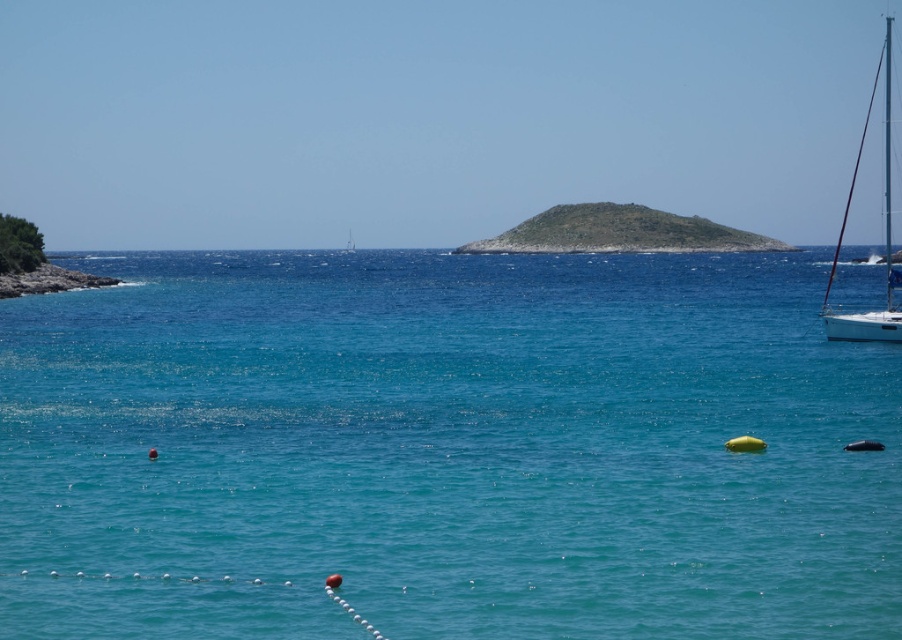
Can you confirm if clear blue water at center is taller than green grassy island at center?

Yes, clear blue water at center is taller than green grassy island at center.

This screenshot has height=640, width=902. I want to click on clear blue water at center, so click(445, 449).

Which is in front, point (380, 618) or point (529, 244)?

Positioned in front is point (380, 618).

In order to click on clear blue water at center in this screenshot , I will do `click(445, 449)`.

What do you see at coordinates (445, 449) in the screenshot?
I see `clear blue water at center` at bounding box center [445, 449].

Which is more to the right, clear blue water at center or smooth stone cliff at lower left?

From the viewer's perspective, clear blue water at center appears more on the right side.

Describe the element at coordinates (445, 449) in the screenshot. The width and height of the screenshot is (902, 640). I see `clear blue water at center` at that location.

Find the location of a particular element. The height and width of the screenshot is (640, 902). clear blue water at center is located at coordinates (445, 449).

Does point (899, 326) come behind point (21, 289)?

No.

In the scene shown: Between white glossy sailboat at right and smooth stone cliff at lower left, which one appears on the right side from the viewer's perspective?

white glossy sailboat at right

You are a GUI agent. You are given a task and a screenshot of the screen. Output one action in this format:
    pyautogui.click(x=<x>, y=<y>)
    Task: Click on the white glossy sailboat at right
    
    Given the screenshot: What is the action you would take?
    pyautogui.click(x=884, y=236)